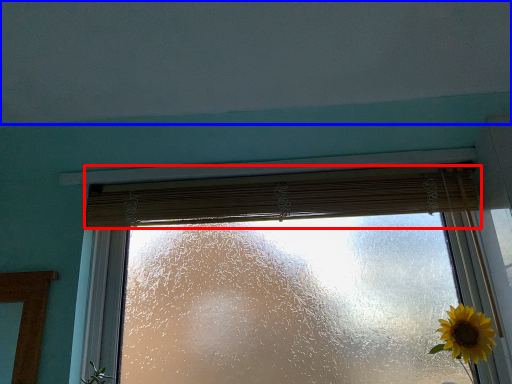
Question: Among these objects, which one is nearest to the camera, curtain (highlighted by a red box) or backdrop (highlighted by a blue box)?

Choices:
 (A) curtain
 (B) backdrop

Answer: (B)